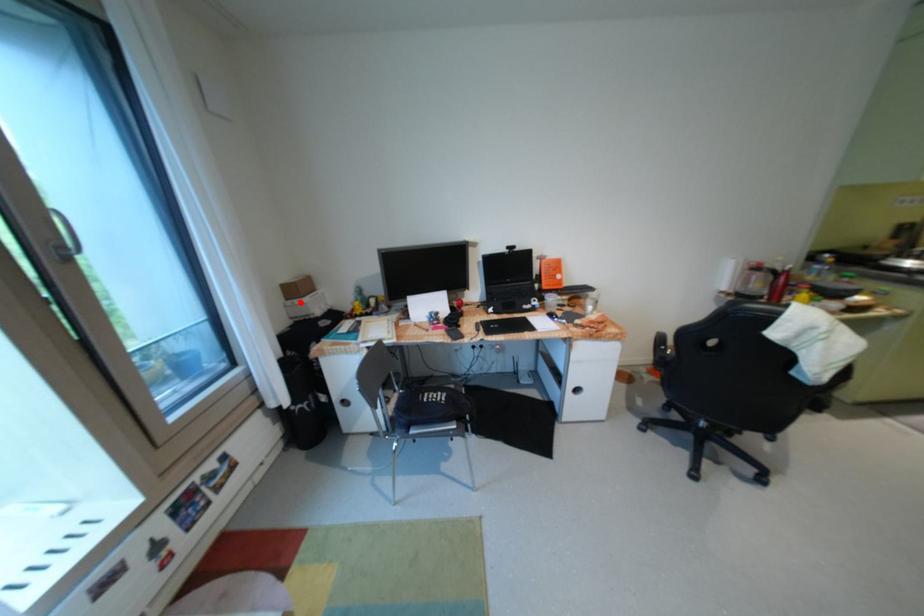
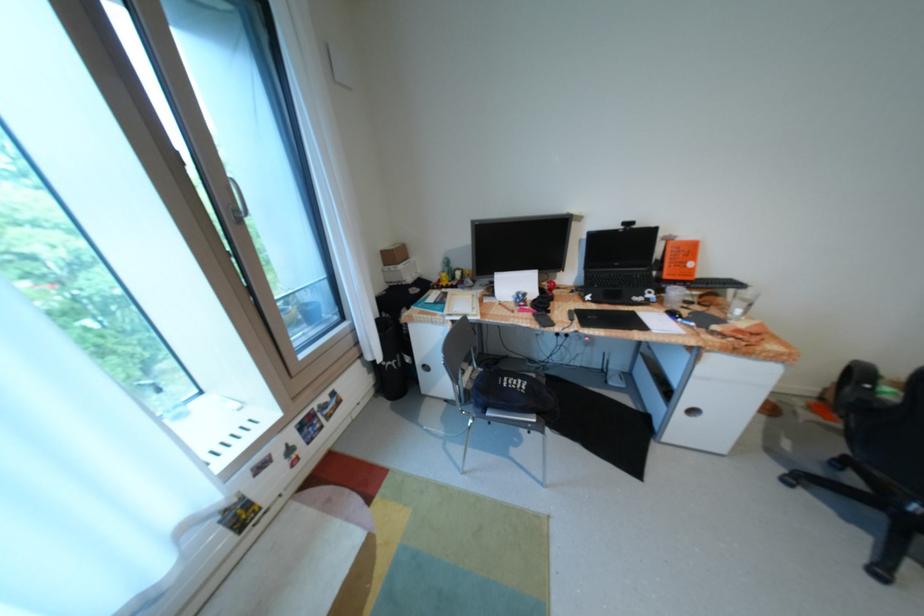
Locate, in the second image, the point that corresponds to the highlighted location in the first image.

(397, 268)